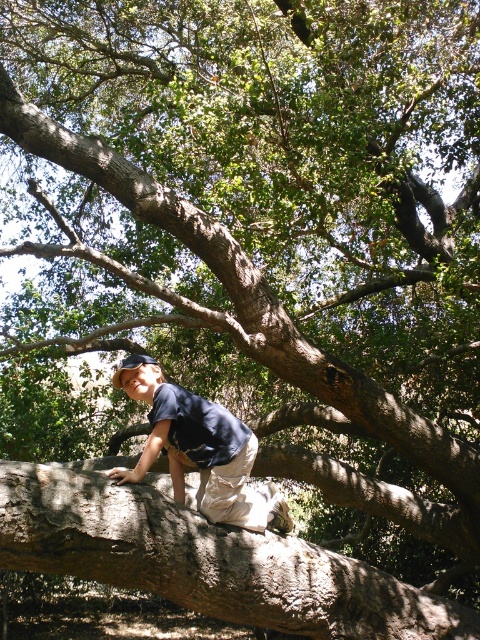
Does brown rough tree trunk at center have a greater width compared to dark blue shirt at center?

Yes.

Is the position of brown rough tree trunk at center more distant than that of dark blue shirt at center?

No.

Who is more distant from viewer, (34,534) or (139,355)?

Point (139,355)

Find the location of a particular element. This screenshot has height=640, width=480. brown rough tree trunk at center is located at coordinates (206, 561).